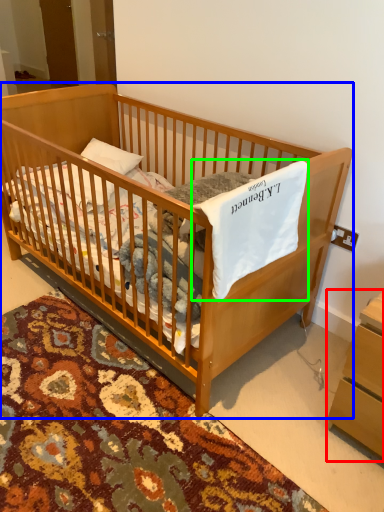
Question: Which is nearer to the changing table (highlighted by a red box)? infant bed (highlighted by a blue box) or sheet (highlighted by a green box).

Choices:
 (A) infant bed
 (B) sheet

Answer: (B)